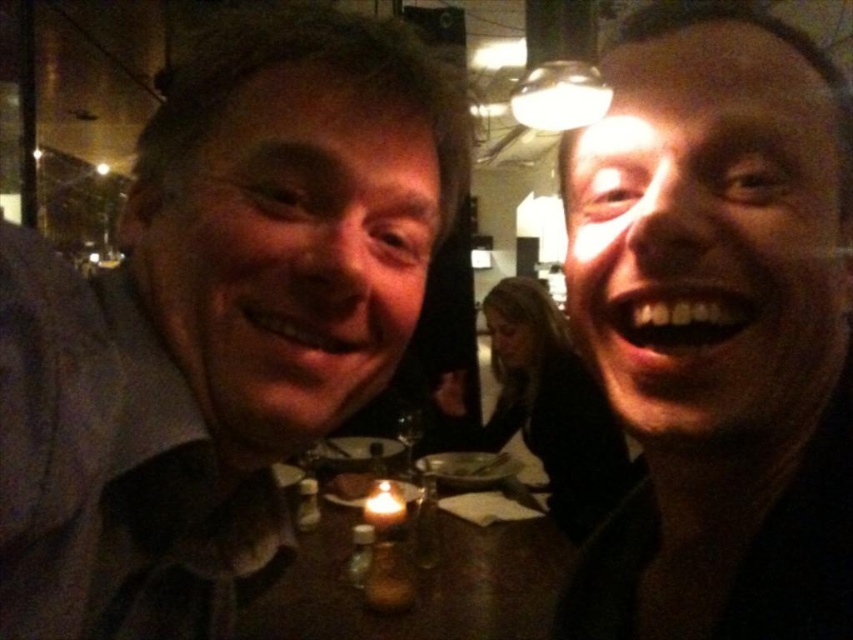
You are a photographer adjusting the lighting in the scene. You need to ensure that the matte black face at center and the white wax candle at center are both well illuminated. Since the candle is a light source, which object should you focus the light on to best highlight both?

The matte black face at center is positioned on the right side of the white wax candle at center. Since the candle is a light source, focusing the light on the matte black face at center will help illuminate both the face and the candle more effectively.

You are a photographer setting up a shot in this scene. You need to position a reflector to bounce light onto the matte black shirt at left and the white wax candle at center. If the reflector can only cover one object at a time, which object should you prioritize to ensure both receive adequate lighting?

The matte black shirt at left might be wider than white wax candle at center, so prioritizing the matte black shirt at left would help illuminate a larger area, ensuring both objects receive sufficient light.

From the picture: You are a waiter at the restaurant and need to place a dessert plate on the table. Considering the size of the wooden table at center and the white wax candle at center, will there be enough space for the plate?

The wooden table at center has a larger size compared to the white wax candle at center, so there will be enough space for the dessert plate.